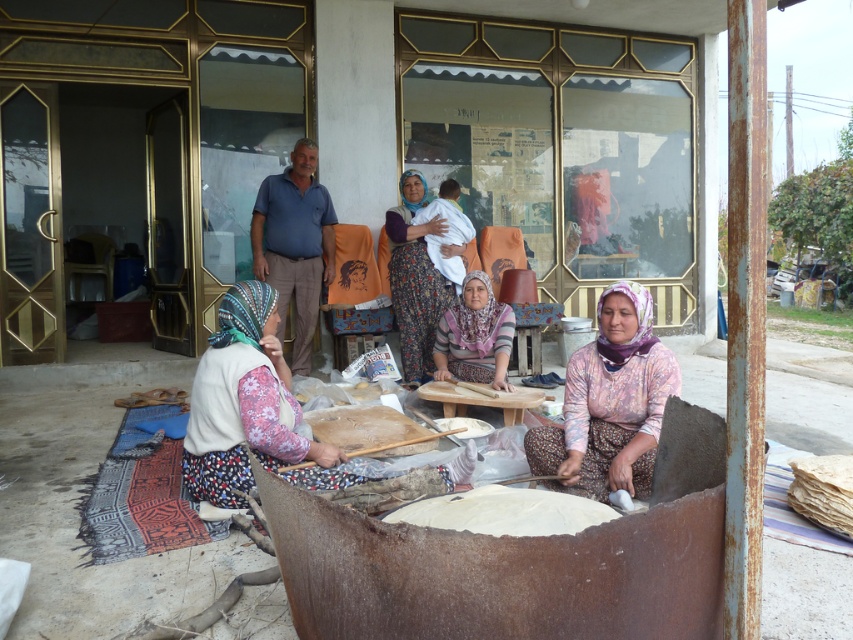
Can you confirm if floral fabric headscarf at lower left is shorter than white dough at center?

Incorrect, floral fabric headscarf at lower left's height does not fall short of white dough at center's.

Is floral fabric headscarf at lower left positioned at the back of white dough at center?

That is True.

This screenshot has width=853, height=640. What do you see at coordinates (248, 406) in the screenshot?
I see `floral fabric headscarf at lower left` at bounding box center [248, 406].

Locate an element on the screen. This screenshot has width=853, height=640. floral fabric headscarf at lower left is located at coordinates (248, 406).

Does point (421, 372) come closer to viewer compared to point (497, 310)?

No.

You are a GUI agent. You are given a task and a screenshot of the screen. Output one action in this format:
    pyautogui.click(x=<x>, y=<y>)
    Task: Click on the floral fabric dress at center
    
    Given the screenshot: What is the action you would take?
    pyautogui.click(x=415, y=276)

You are a GUI agent. You are given a task and a screenshot of the screen. Output one action in this format:
    pyautogui.click(x=<x>, y=<y>)
    Task: Click on the floral fabric dress at center
    
    Given the screenshot: What is the action you would take?
    pyautogui.click(x=415, y=276)

Can you confirm if floral fabric headscarf at lower left is thinner than floral fabric dress at center?

In fact, floral fabric headscarf at lower left might be wider than floral fabric dress at center.

Can you confirm if floral fabric headscarf at lower left is taller than floral fabric dress at center?

No, floral fabric headscarf at lower left is not taller than floral fabric dress at center.

Who is more forward, (x=212, y=385) or (x=399, y=212)?

Point (x=212, y=385) is in front.

At what (x,y) coordinates should I click in order to perform the action: click on floral fabric headscarf at lower left. Please return your answer as a coordinate pair (x, y). Image resolution: width=853 pixels, height=640 pixels. Looking at the image, I should click on (248, 406).